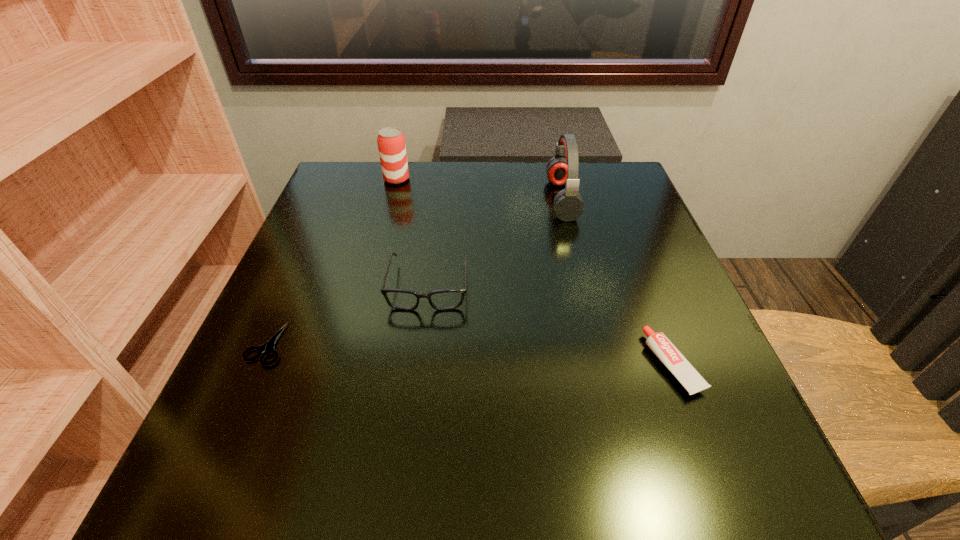
This screenshot has width=960, height=540. Find the location of `shears at the left edge`. shears at the left edge is located at coordinates (268, 348).

At what (x,y) coordinates should I click in order to perform the action: click on earphone at the right edge. Please return your answer as a coordinate pair (x, y). Looking at the image, I should click on 562,169.

Find the location of `toothpaste that is at the right edge`. toothpaste that is at the right edge is located at coordinates (669, 355).

Where is `object that is at the far left corner`? This screenshot has height=540, width=960. object that is at the far left corner is located at coordinates (391, 141).

Where is `object situated at the far right corner`? The width and height of the screenshot is (960, 540). object situated at the far right corner is located at coordinates (562, 169).

Locate an element on the screen. This screenshot has width=960, height=540. vacant area at the far edge of the desktop is located at coordinates (517, 173).

In the image, there is a desktop. What are the coordinates of `blank space at the near edge` in the screenshot? It's located at (342, 503).

Locate an element on the screen. The width and height of the screenshot is (960, 540). vacant space at the left edge is located at coordinates (359, 224).

Image resolution: width=960 pixels, height=540 pixels. What are the coordinates of `vacant space at the right edge of the desktop` in the screenshot? It's located at (630, 387).

The image size is (960, 540). I want to click on free space at the far left corner of the desktop, so click(x=341, y=191).